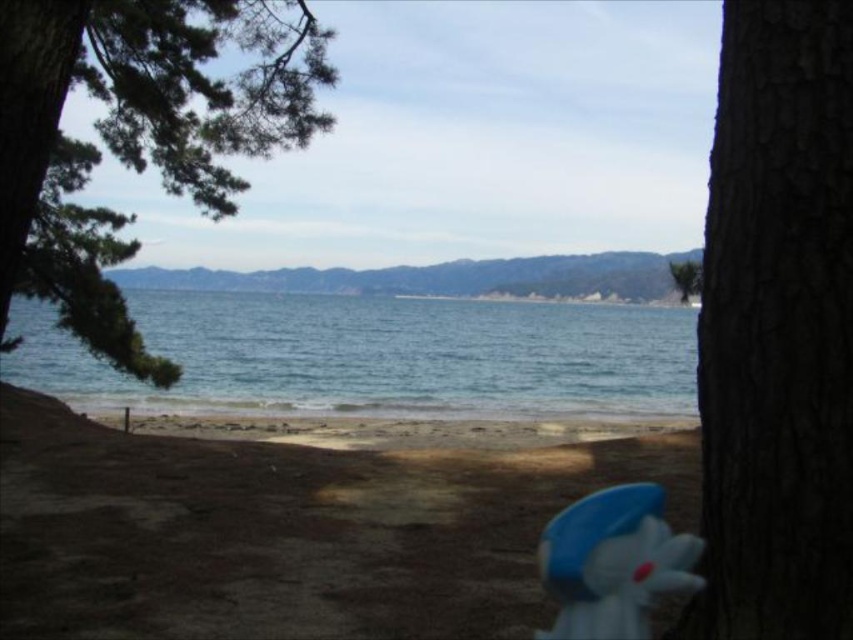
You are standing at the point with coordinates (376, 356) in the coastal scene. What do you see directly in front of you?

At point (376, 356) lies blue water at center, so you would see blue water at center directly in front of you.

You are standing at the beach looking at the scene. Which object, the blue water at center or the green matte tree at upper center, appears closer to you based on their relative sizes?

The blue water at center appears closer because it is taller than the green matte tree at upper center, making it seem nearer in the visual perspective.

You are an artist setting up an easel to paint the coastal scene. You want to ensure the green textured pine branch at upper left and the green matte tree at upper center are both visible in your painting. Which object should you place higher on the canvas to maintain their relative positions?

The green matte tree at upper center should be placed higher on the canvas because it is taller than the green textured pine branch at upper left.